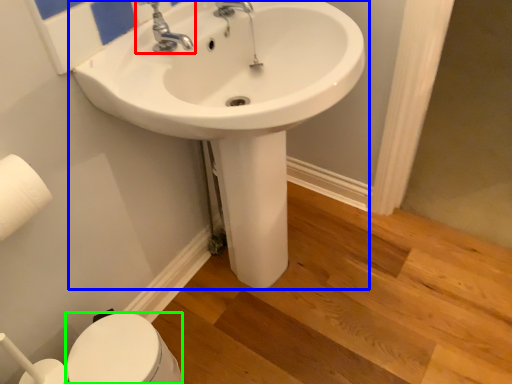
Question: Considering the real-world distances, which object is farthest from tap (highlighted by a red box)? sink (highlighted by a blue box) or bidet (highlighted by a green box)?

Choices:
 (A) sink
 (B) bidet

Answer: (B)